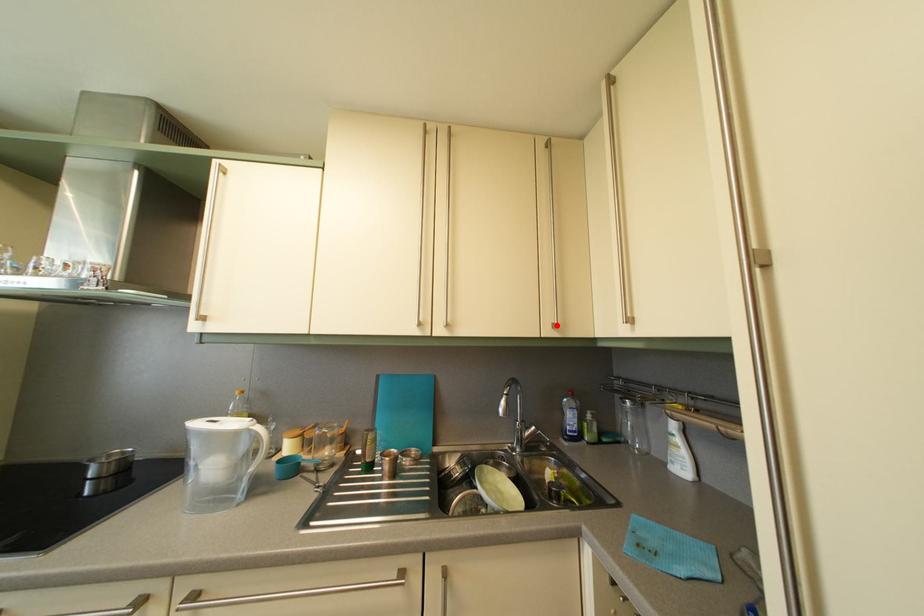
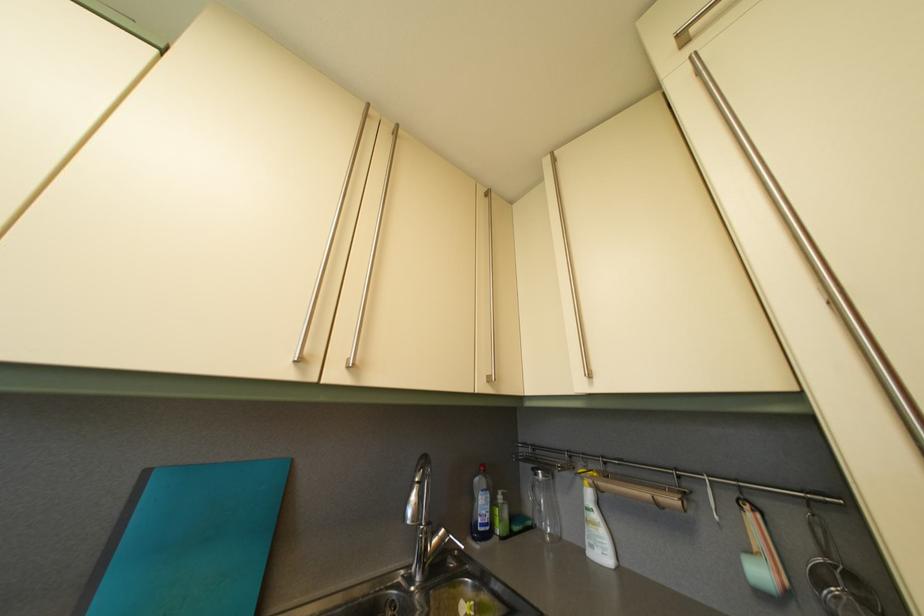
Locate, in the second image, the point that corresponds to the highlighted location in the first image.

(492, 376)